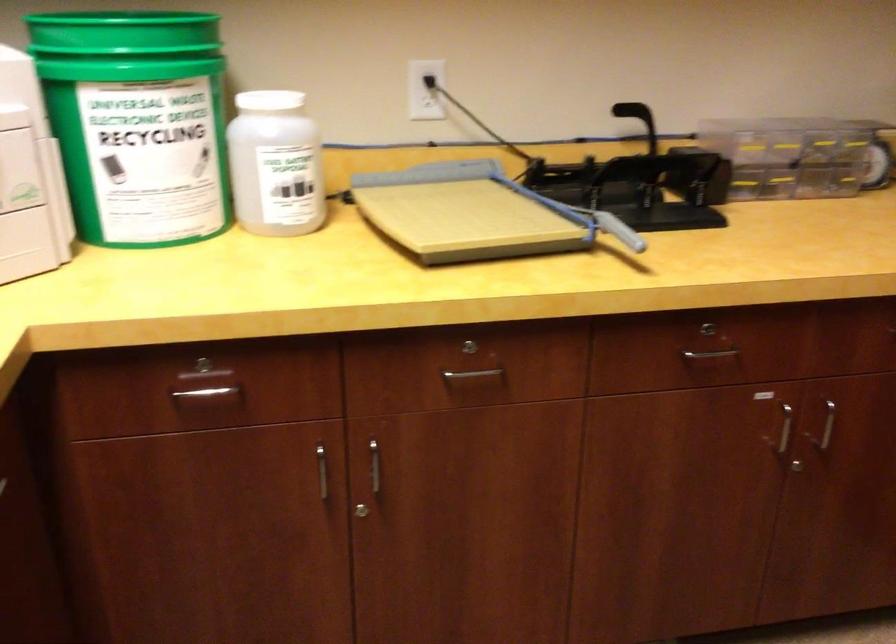
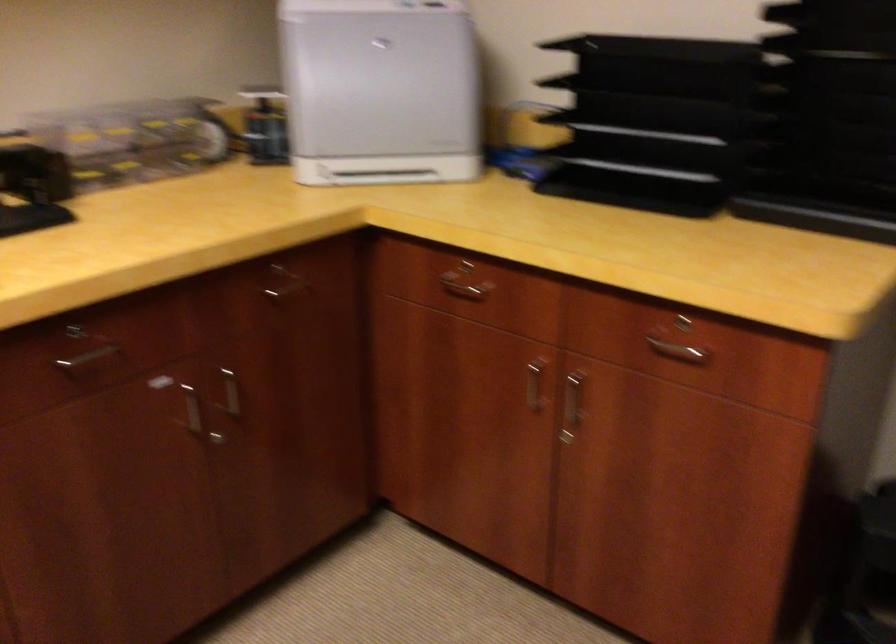
Where in the second image is the point corresponding to (x=703, y=357) from the first image?

(90, 355)